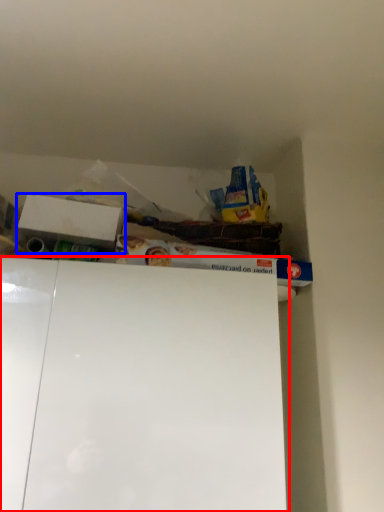
Question: Among these objects, which one is farthest to the camera, cabinet (highlighted by a red box) or box (highlighted by a blue box)?

Choices:
 (A) cabinet
 (B) box

Answer: (B)